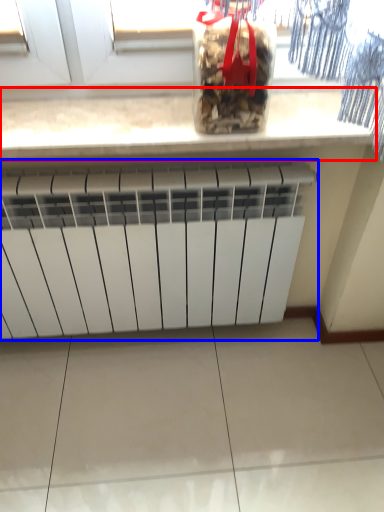
Question: Which of the following is the farthest to the observer, countertop (highlighted by a red box) or radiator (highlighted by a blue box)?

Choices:
 (A) countertop
 (B) radiator

Answer: (B)